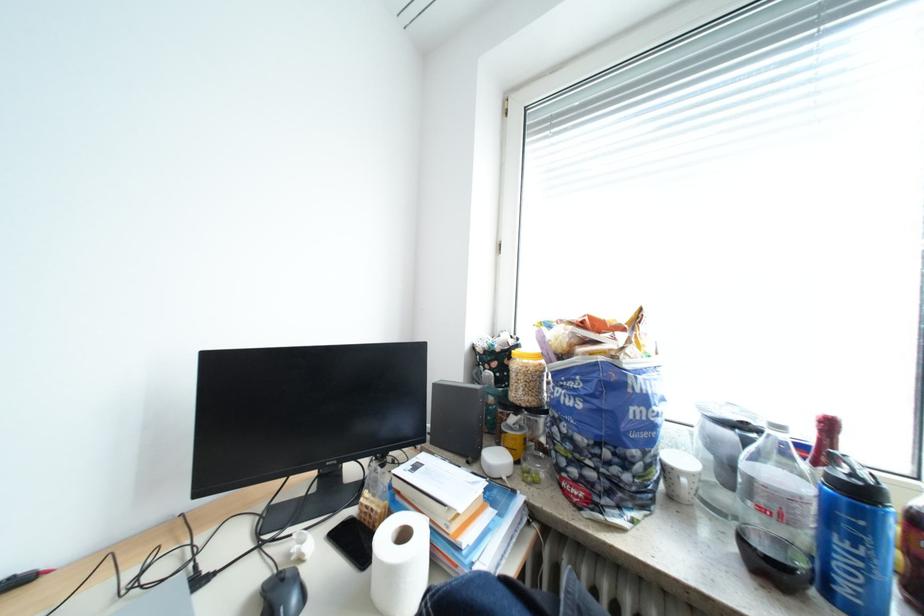
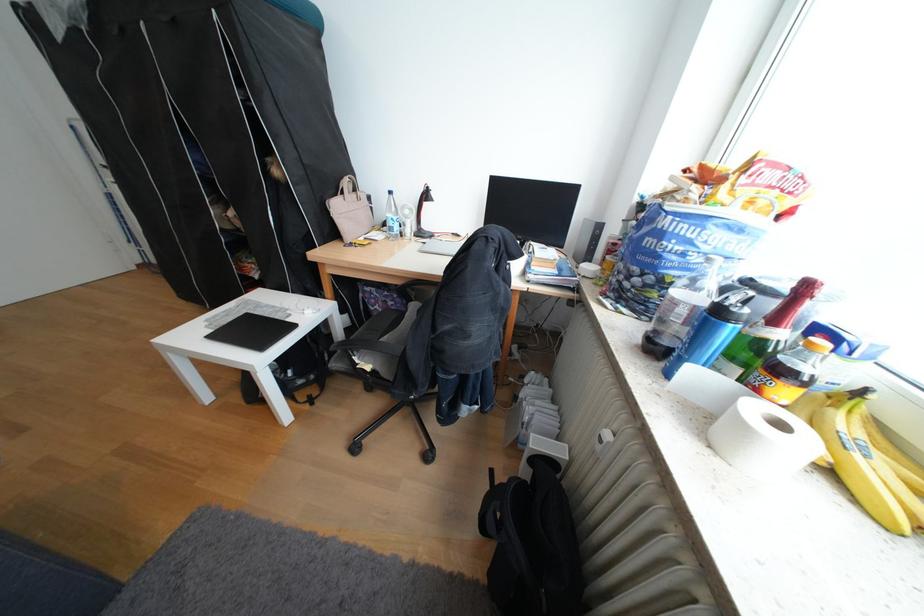
Locate, in the second image, the point that corresponds to (x=825, y=509) in the first image.

(695, 312)